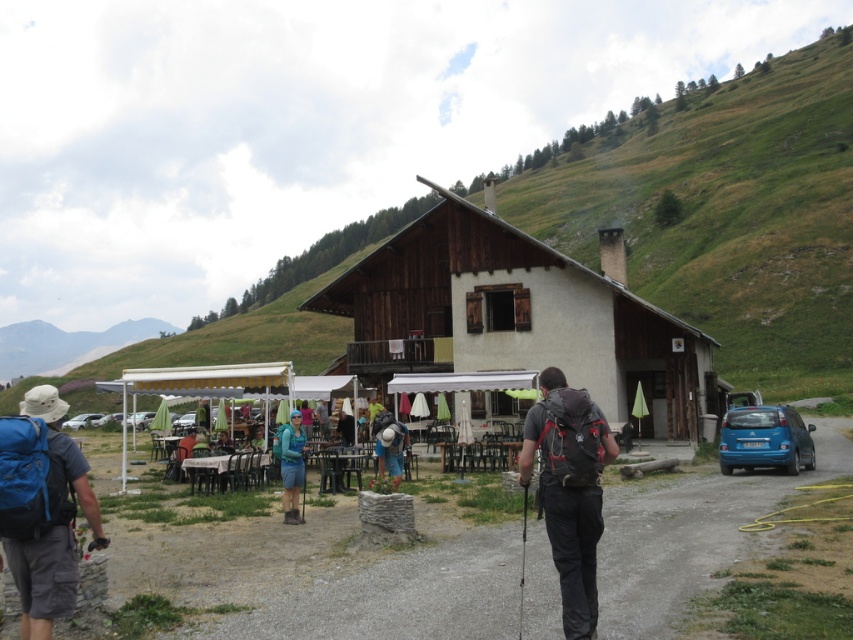
Between wooden cabin at center and denim jacket at center, which one has less height?

denim jacket at center

You are a GUI agent. You are given a task and a screenshot of the screen. Output one action in this format:
    pyautogui.click(x=<x>, y=<y>)
    Task: Click on the wooden cabin at center
    The image size is (853, 640).
    Given the screenshot: What is the action you would take?
    pyautogui.click(x=517, y=317)

Which is behind, point (590, 304) or point (381, 429)?

Point (590, 304)

In order to click on wooden cabin at center in this screenshot , I will do `click(517, 317)`.

Who is more distant from viewer, (x=418, y=296) or (x=809, y=464)?

The point (x=418, y=296) is more distant.

Who is higher up, wooden cabin at center or blue matte car at right?

wooden cabin at center

This screenshot has height=640, width=853. What do you see at coordinates (517, 317) in the screenshot?
I see `wooden cabin at center` at bounding box center [517, 317].

You are a GUI agent. You are given a task and a screenshot of the screen. Output one action in this format:
    pyautogui.click(x=<x>, y=<y>)
    Task: Click on the wooden cabin at center
    
    Given the screenshot: What is the action you would take?
    pyautogui.click(x=517, y=317)

Between matte black backpack at center and blue fabric backpack at left, which one appears on the left side from the viewer's perspective?

From the viewer's perspective, blue fabric backpack at left appears more on the left side.

Between matte black backpack at center and blue fabric backpack at left, which one appears on the right side from the viewer's perspective?

matte black backpack at center

The height and width of the screenshot is (640, 853). Describe the element at coordinates (569, 490) in the screenshot. I see `matte black backpack at center` at that location.

Identify the location of matte black backpack at center. This screenshot has height=640, width=853. (569, 490).